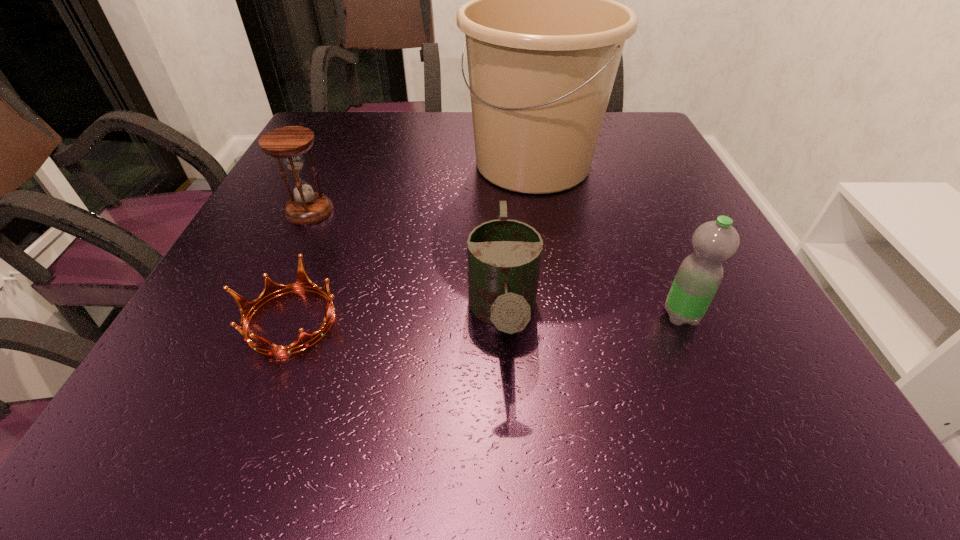
Where is `free spot between the watering can and the water bottle`? Image resolution: width=960 pixels, height=540 pixels. free spot between the watering can and the water bottle is located at coordinates (592, 315).

Locate an element on the screen. empty space that is in between the watering can and the water bottle is located at coordinates (592, 315).

At what (x,y) coordinates should I click in order to perform the action: click on free area in between the bucket and the water bottle. Please return your answer as a coordinate pair (x, y). The image size is (960, 540). Looking at the image, I should click on (607, 240).

The image size is (960, 540). I want to click on vacant area between the bucket and the water bottle, so click(x=607, y=240).

Identify which object is located as the third nearest to the water bottle. Please provide its 2D coordinates. Your answer should be formatted as a tuple, i.e. [(x, y)], where the tuple contains the x and y coordinates of a point satisfying the conditions above.

[(272, 289)]

Identify which object is located as the fourth nearest to the tallest object. Please provide its 2D coordinates. Your answer should be formatted as a tuple, i.e. [(x, y)], where the tuple contains the x and y coordinates of a point satisfying the conditions above.

[(272, 289)]

Find the location of a particular element. This screenshot has width=960, height=540. vacant region that satisfies the following two spatial constraints: 1. with the spout on the water bottle; 2. on the right side of the watering can is located at coordinates tap(503, 315).

You are a GUI agent. You are given a task and a screenshot of the screen. Output one action in this format:
    pyautogui.click(x=<x>, y=<y>)
    Task: Click on the free space that satisfies the following two spatial constraints: 1. on the back side of the tallest object; 2. on the right side of the crown
    
    Given the screenshot: What is the action you would take?
    pyautogui.click(x=353, y=164)